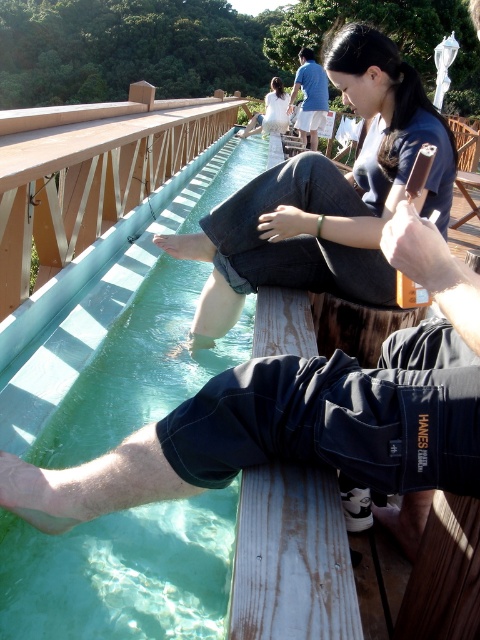
You are a lifeguard standing at the edge of the wooden deck in the image. You need to reach the person wearing denim jeans at center as quickly as possible. Which direction should you move in to get to them?

The denim jeans at center is located at point 0.308 on the x axis and 0.681 on the y axis, so you should move towards the center of the wooden deck to reach the person wearing denim jeans at center.

You are standing at the point marked as point (x=94, y=433) and want to reach the water slide. The distance between you and the water slide is 8.43 feet. If you can walk 10 feet in a minute, how long will it take you to reach the water slide?

The distance between you and the water slide is 8.43 feet. Since you can walk 10 feet in a minute, it will take you approximately 0.843 minutes, which is about 50.6 seconds, to reach the water slide.